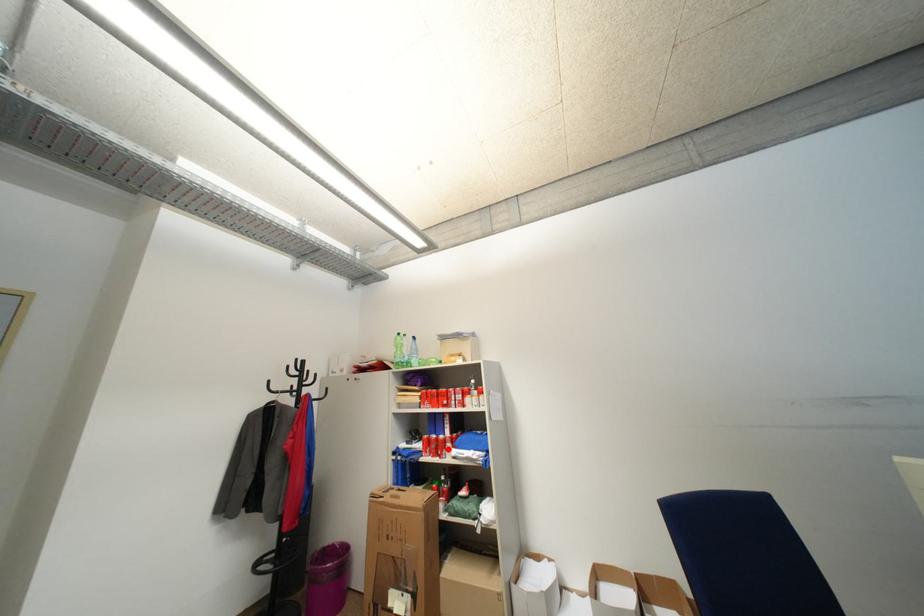
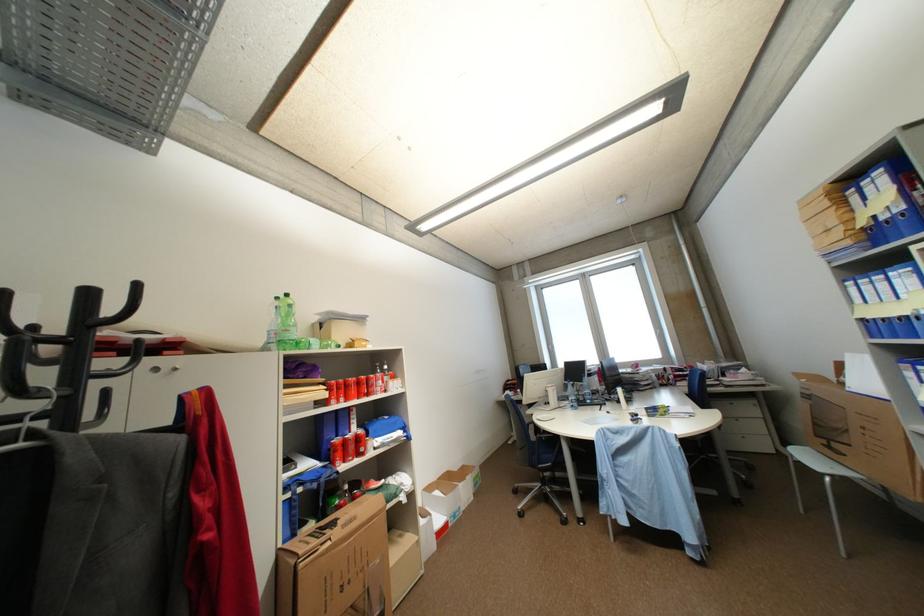
Question: I am providing you with two images of the same scene from different viewpoints. A red point is shown in image1. For the corresponding object point in image2, is it positioned nearer or farther from the camera?

Choices:
 (A) Nearer
 (B) Farther

Answer: (A)